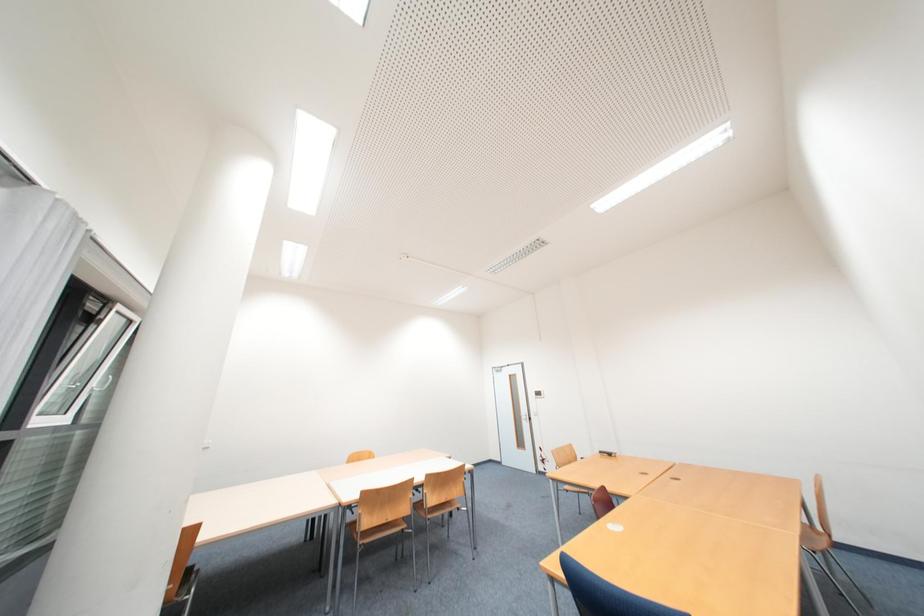
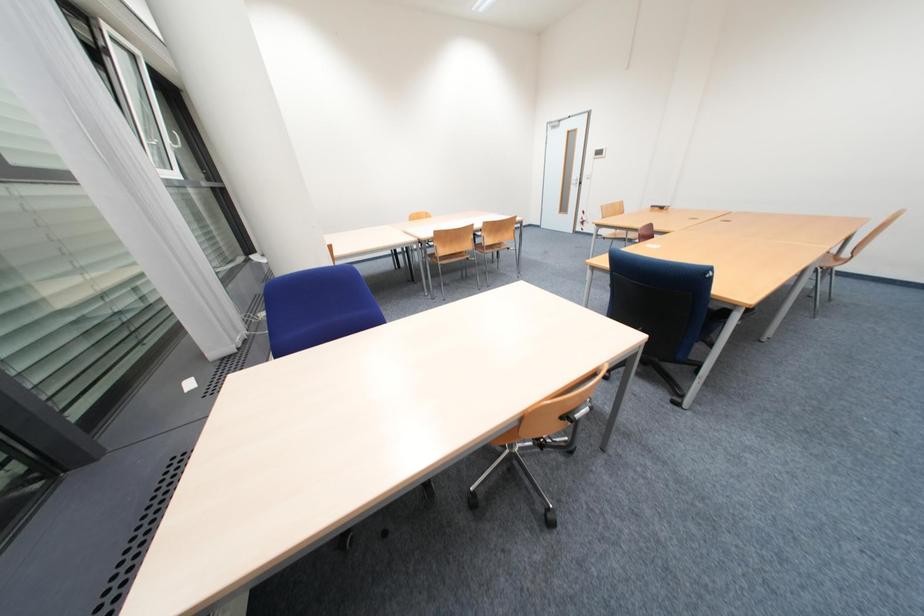
Question: The images are taken continuously from a first-person perspective. In which direction is your viewpoint rotating?

Choices:
 (A) Left
 (B) Right
 (C) Up
 (D) Down

Answer: (D)